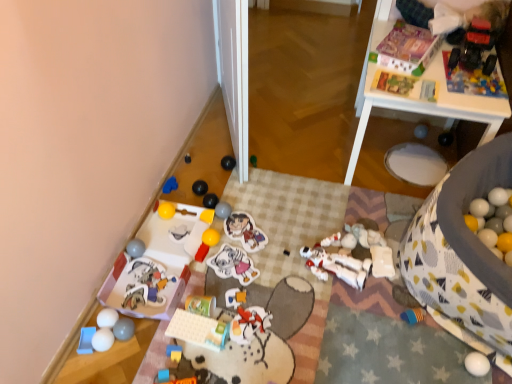
Locate an element on the screen. This screenshot has height=384, width=512. free space to the right of white matte balls at lower left, which appears as the 2th toy when viewed from the left is located at coordinates click(x=149, y=341).